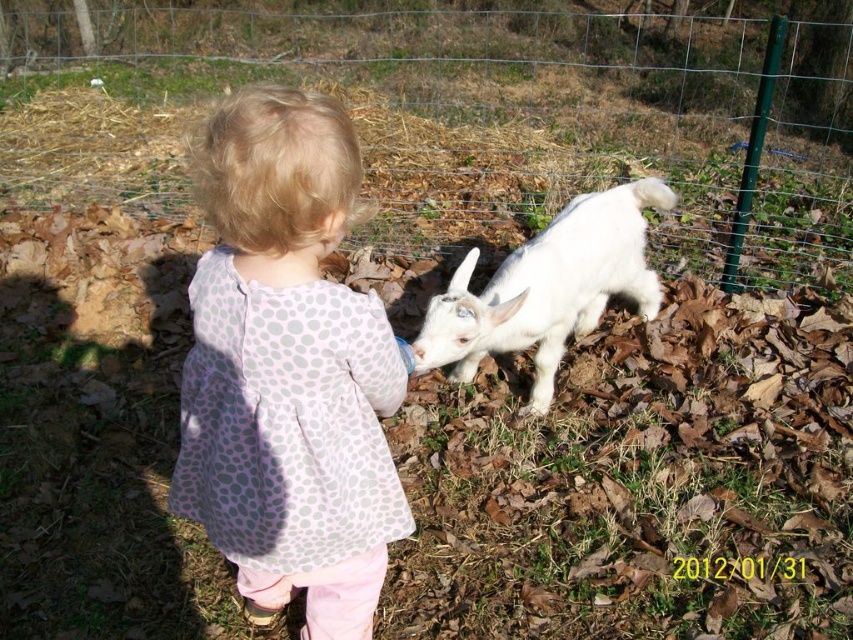
You are a photographer trying to capture a photo of the wire mesh fence at center and the pink dotted fabric at center. Based on their positions, which object should you adjust your camera to focus on first if you want to include both in the frame?

The wire mesh fence at center should be focused on first because it is positioned to the left of the pink dotted fabric at center, so adjusting focus from left to right would naturally include both in the frame.

You are a photographer trying to capture a photo of the white fluffy goat at center without the wire mesh fence at center appearing in the shot. Based on their sizes, can you suggest a way to frame the shot?

Since the wire mesh fence at center is much taller than the white fluffy goat at center, you can crouch down to lower your camera angle so that the fence is out of frame while the goat remains visible.

In the scene shown: You are a painter standing in the scene. You want to hang a small painting on the wire mesh fence at center or the pink dotted fabric at center. Which surface can you hang the painting on without it touching the ground?

The wire mesh fence at center has a greater height compared to pink dotted fabric at center, so you can hang the painting on the wire mesh fence at center without it touching the ground.